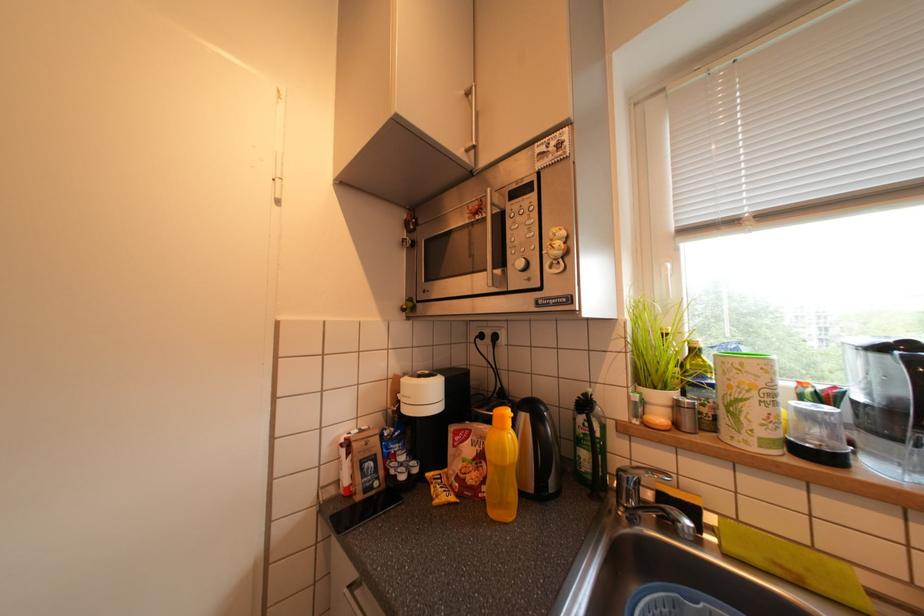
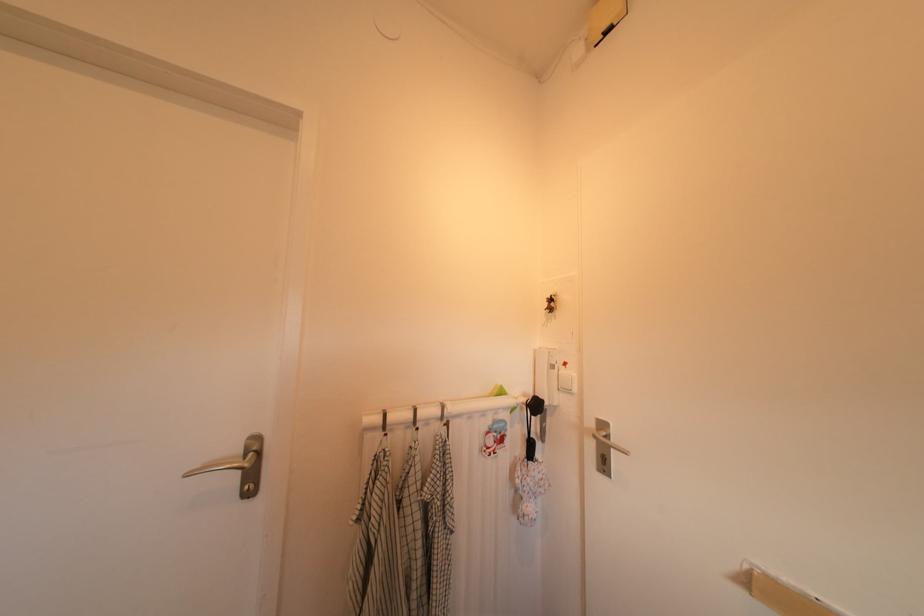
Question: The camera is either moving clockwise (left) or counter-clockwise (right) around the object. The first image is from the beginning of the video and the second image is from the end. Is the camera moving left or right when shooting the video?

Choices:
 (A) Left
 (B) Right

Answer: (B)